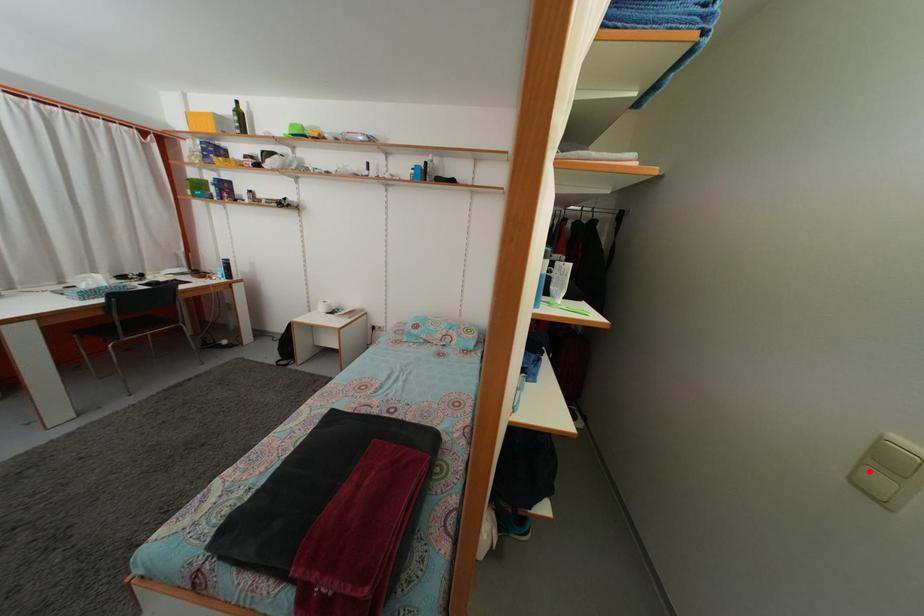
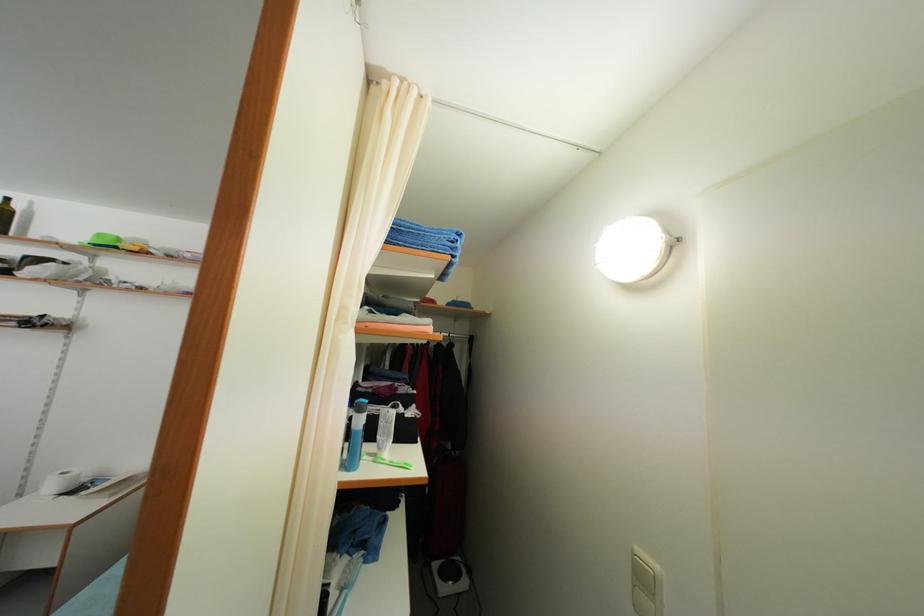
Question: I am providing you with two images of the same scene from different viewpoints. Given a red point in image1, look at the same physical point in image2. Is it:

Choices:
 (A) Closer to the viewpoint
 (B) Farther from the viewpoint

Answer: (A)